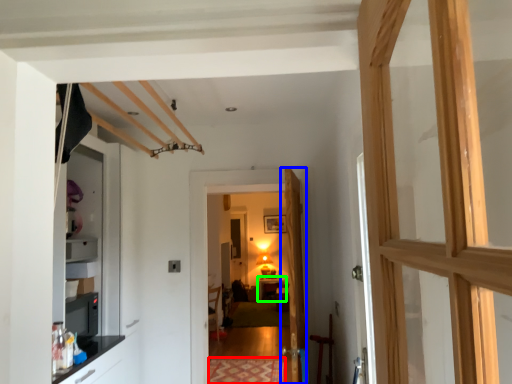
Question: Which object is the closest to the mat (highlighted by a red box)? Choose among these: door (highlighted by a blue box) or table (highlighted by a green box).

Choices:
 (A) door
 (B) table

Answer: (A)